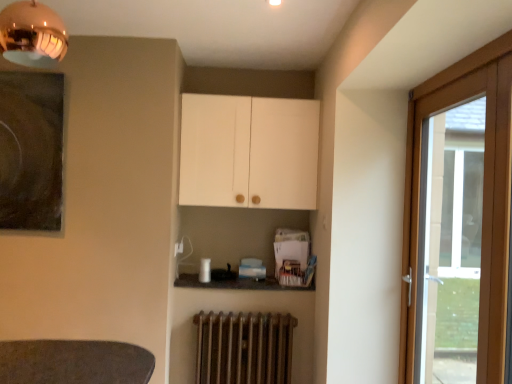
Question: Is wooden door at right behind granite countertop at center?

Choices:
 (A) yes
 (B) no

Answer: (B)

Question: Is wooden door at right aimed at granite countertop at center?

Choices:
 (A) no
 (B) yes

Answer: (A)

Question: Does wooden door at right have a smaller size compared to granite countertop at center?

Choices:
 (A) yes
 (B) no

Answer: (B)

Question: Considering the relative positions of wooden door at right and granite countertop at center in the image provided, is wooden door at right to the right of granite countertop at center from the viewer's perspective?

Choices:
 (A) yes
 (B) no

Answer: (A)

Question: Considering the relative sizes of wooden door at right and granite countertop at center in the image provided, is wooden door at right bigger than granite countertop at center?

Choices:
 (A) no
 (B) yes

Answer: (B)

Question: Is wooden door at right wider or thinner than granite countertop at center?

Choices:
 (A) thin
 (B) wide

Answer: (A)

Question: Is wooden door at right spatially inside granite countertop at center, or outside of it?

Choices:
 (A) inside
 (B) outside

Answer: (B)

Question: Is point (460, 135) closer or farther from the camera than point (267, 284)?

Choices:
 (A) closer
 (B) farther

Answer: (A)

Question: From a real-world perspective, is wooden door at right above or below granite countertop at center?

Choices:
 (A) below
 (B) above

Answer: (B)

Question: Is granite countertop at center taller or shorter than rusty metal radiator at lower center?

Choices:
 (A) tall
 (B) short

Answer: (B)

Question: Considering their positions, is granite countertop at center located in front of or behind rusty metal radiator at lower center?

Choices:
 (A) behind
 (B) front

Answer: (A)

Question: Choose the correct answer: Is granite countertop at center inside rusty metal radiator at lower center or outside it?

Choices:
 (A) outside
 (B) inside

Answer: (A)

Question: Based on their positions, is granite countertop at center located to the left or right of rusty metal radiator at lower center?

Choices:
 (A) left
 (B) right

Answer: (A)

Question: From their relative heights in the image, would you say granite countertop at center is taller or shorter than white matte cabinet at upper center?

Choices:
 (A) tall
 (B) short

Answer: (B)

Question: Which is correct: granite countertop at center is inside white matte cabinet at upper center, or outside of it?

Choices:
 (A) inside
 (B) outside

Answer: (B)